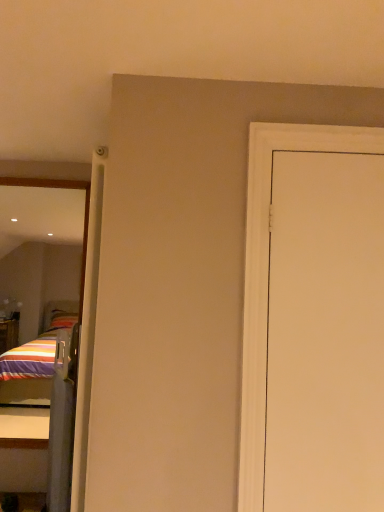
Question: Looking at the image, does white matte door at right seem bigger or smaller compared to reflective glass mirror at left?

Choices:
 (A) big
 (B) small

Answer: (B)

Question: Considering the positions of point (311, 323) and point (84, 209), is point (311, 323) closer or farther from the camera than point (84, 209)?

Choices:
 (A) closer
 (B) farther

Answer: (A)

Question: Estimate the real-world distances between objects in this image. Which object is farther from the clear plastic screen door at left?

Choices:
 (A) white matte door at right
 (B) reflective glass mirror at left

Answer: (A)

Question: Which of these objects is positioned farthest from the reflective glass mirror at left?

Choices:
 (A) clear plastic screen door at left
 (B) white matte door at right

Answer: (B)